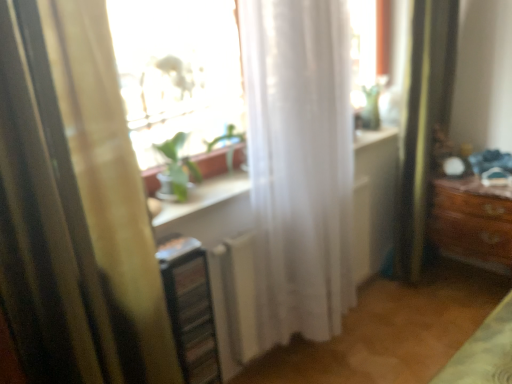
Locate an element on the screen. vacant region below white sheer curtain at center, positioned as the 1th curtain in right-to-left order (from a real-world perspective) is located at coordinates (325, 355).